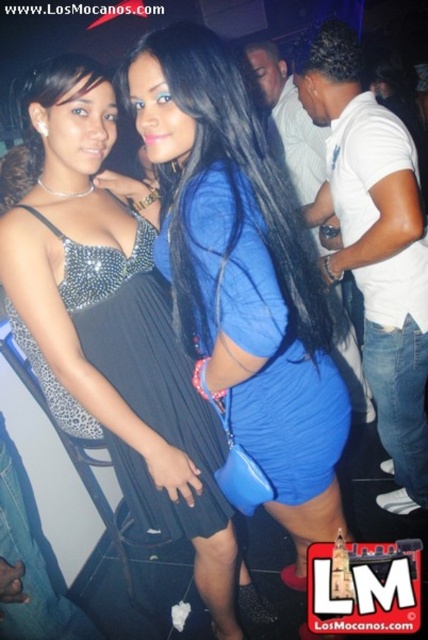
Question: Which object appears farthest from the camera in this image?

Choices:
 (A) blue matte dress at center
 (B) blue fabric dress at center
 (C) black satin dress at left

Answer: (C)

Question: Based on their relative distances, which object is nearer to the black satin dress at left?

Choices:
 (A) blue fabric dress at center
 (B) blue matte dress at center

Answer: (A)

Question: Which is nearer to the blue fabric dress at center?

Choices:
 (A) black satin dress at left
 (B) blue matte dress at center

Answer: (B)

Question: Can you confirm if blue fabric dress at center is positioned above black satin dress at left?

Choices:
 (A) no
 (B) yes

Answer: (B)

Question: Is blue matte dress at center to the left of black satin dress at left from the viewer's perspective?

Choices:
 (A) yes
 (B) no

Answer: (B)

Question: Does blue matte dress at center appear on the left side of black satin dress at left?

Choices:
 (A) yes
 (B) no

Answer: (B)